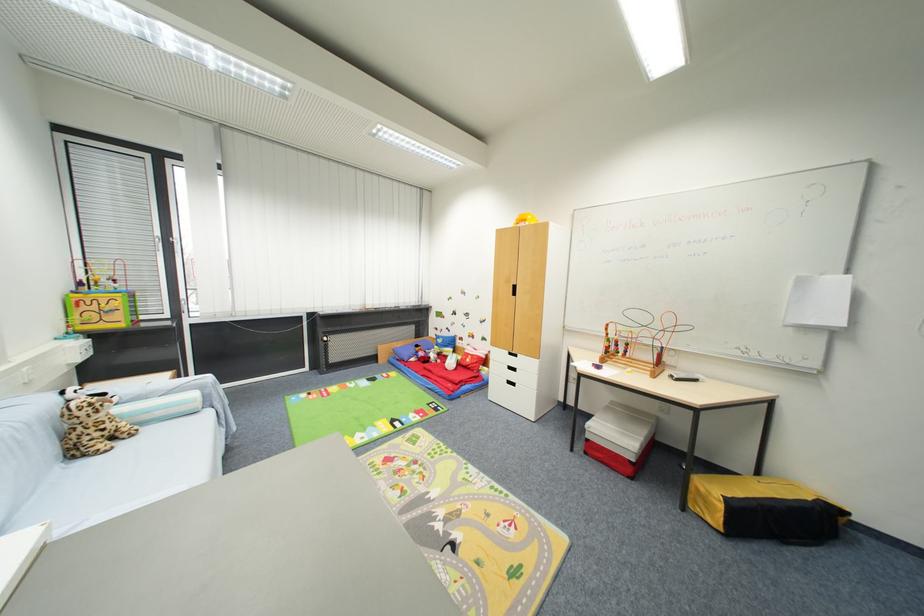
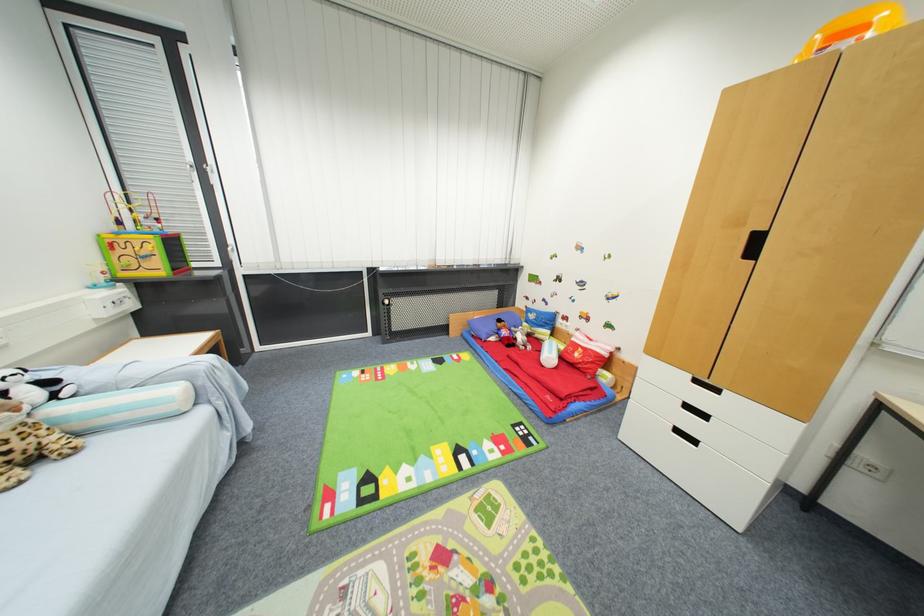
Question: What movement of the cameraman would produce the second image?

Choices:
 (A) Left
 (B) Right
 (C) Forward
 (D) Backward

Answer: (C)